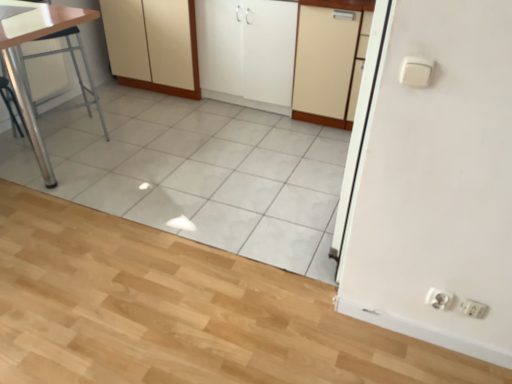
Question: Considering the relative positions of white matte cabinet at center, the second cabinetry viewed from the left, and white glossy sink at upper left in the image provided, is white matte cabinet at center, the second cabinetry viewed from the left, to the left or to the right of white glossy sink at upper left?

Choices:
 (A) left
 (B) right

Answer: (B)

Question: From a real-world perspective, is white matte cabinet at center, the second cabinetry viewed from the left, above or below white glossy sink at upper left?

Choices:
 (A) above
 (B) below

Answer: (B)

Question: Based on their relative distances, which object is farther from the white glossy sink at upper left?

Choices:
 (A) metallic silver table at left
 (B) white plastic electric outlet at lower right, the second electric outlet positioned from the left
 (C) white matte cabinet at center, which ranks as the 2th cabinetry in right-to-left order
 (D) beige matte cabinet at center, the third cabinetry when ordered from left to right
 (E) white matte cabinet at center, the first cabinetry from the left

Answer: (B)

Question: Estimate the real-world distances between objects in this image. Which object is closer to the white matte cabinet at center, the 3th cabinetry when ordered from right to left?

Choices:
 (A) metallic silver table at left
 (B) beige matte cabinet at center, the third cabinetry when ordered from left to right
 (C) white matte cabinet at center, which ranks as the 2th cabinetry in right-to-left order
 (D) white plastic electric outlet at lower right, the second electric outlet positioned from the left
 (E) white plastic electric outlet at lower right, positioned as the second electric outlet in right-to-left order

Answer: (C)